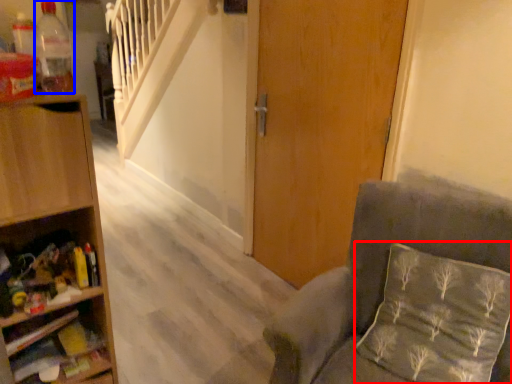
Question: Which object is further to the camera taking this photo, pillow (highlighted by a red box) or bottle (highlighted by a blue box)?

Choices:
 (A) pillow
 (B) bottle

Answer: (A)